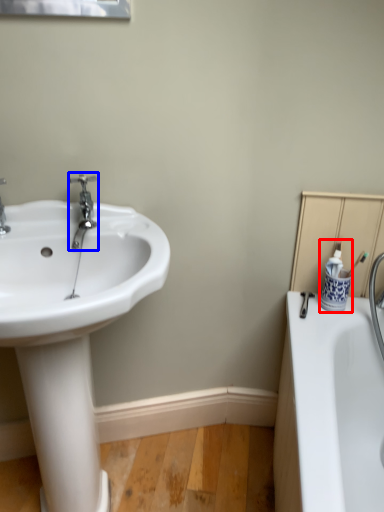
Question: Which of the following is the farthest to the observer, toiletry (highlighted by a red box) or tap (highlighted by a blue box)?

Choices:
 (A) toiletry
 (B) tap

Answer: (A)